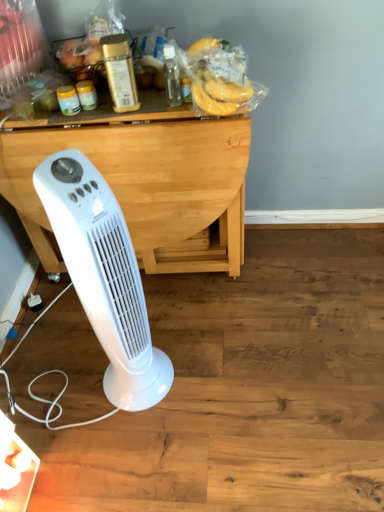
Locate an element on the screen. empty space that is to the right of gold metallic container at upper center, the second bottle viewed from the right is located at coordinates (159, 104).